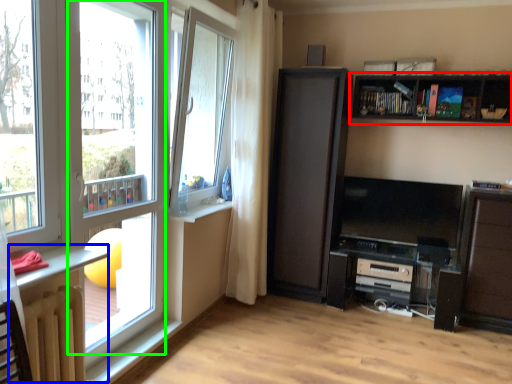
Question: Which is farther away from shelf (highlighted by a red box)? table (highlighted by a blue box) or window frame (highlighted by a green box)?

Choices:
 (A) table
 (B) window frame

Answer: (A)